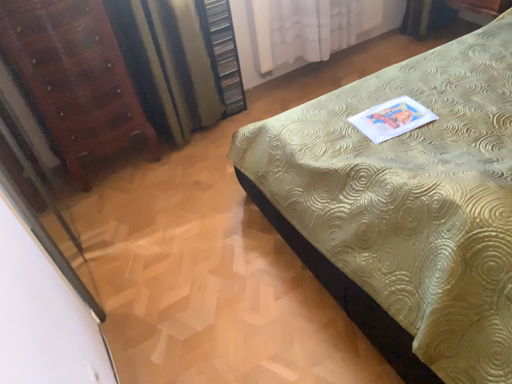
The width and height of the screenshot is (512, 384). In order to click on free region under transparent glass screen door at left (from a real-world perspective) in this screenshot , I will do `click(93, 278)`.